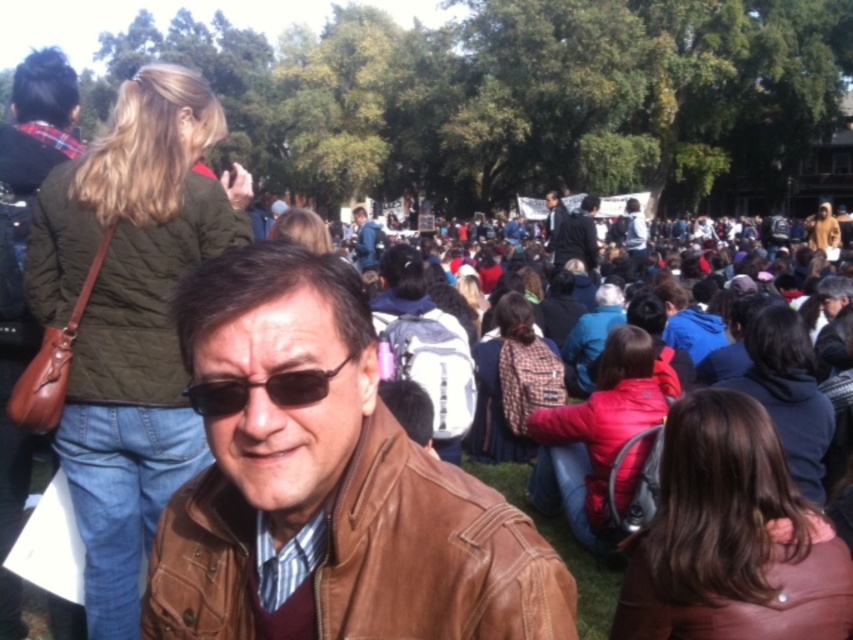
You are standing at point [367,221] and want to walk to the man in the brown leather jacket. Which direction should you move relative to point [230,385]?

To reach the man in the brown leather jacket, you should move towards point [230,385], which is in front of point [367,221].

You are a photographer at the event and want to capture both the black leather goggles at center and the blue denim jacket at center in a single frame. Which object should you focus on first to ensure both are in the frame?

The black leather goggles at center is shorter than the blue denim jacket at center. Therefore, you should focus on the blue denim jacket at center first, as it is taller and will require more space in the frame to include both objects properly.